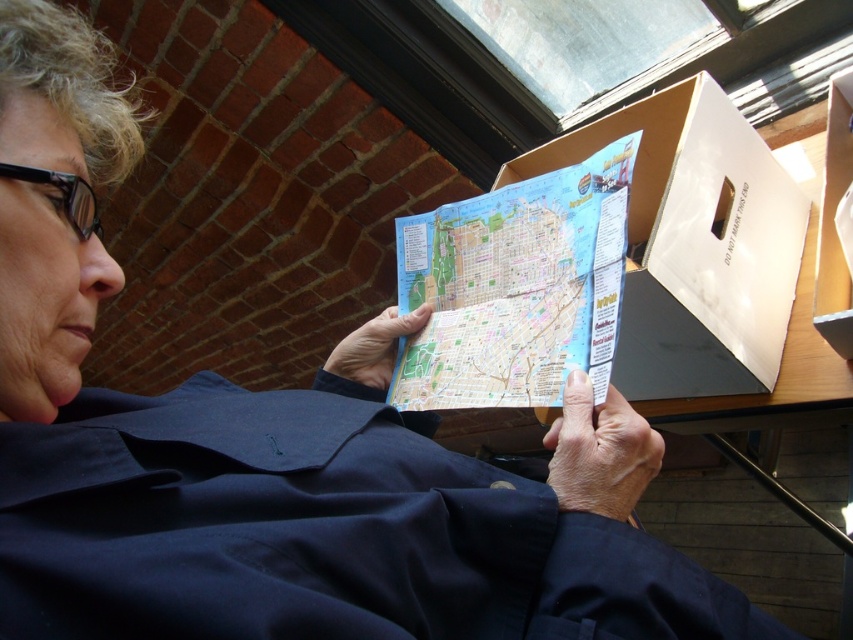
Question: Can you confirm if navy blue fabric at center is thinner than colorful paper map at center?

Choices:
 (A) yes
 (B) no

Answer: (B)

Question: Is navy blue fabric at center above colorful paper map at center?

Choices:
 (A) yes
 (B) no

Answer: (B)

Question: From the image, what is the correct spatial relationship of navy blue fabric at center in relation to colorful paper map at center?

Choices:
 (A) below
 (B) above

Answer: (A)

Question: Which point appears closest to the camera in this image?

Choices:
 (A) (543, 339)
 (B) (126, 403)

Answer: (B)

Question: Which point appears farthest from the camera in this image?

Choices:
 (A) (399, 461)
 (B) (496, 300)

Answer: (B)